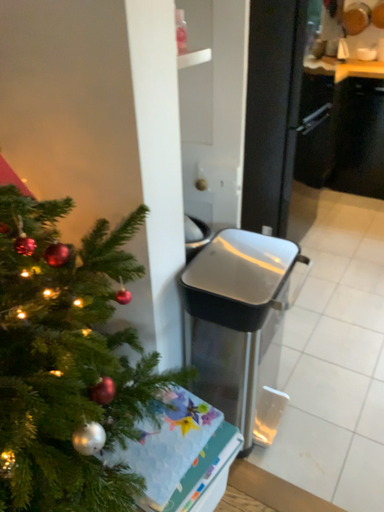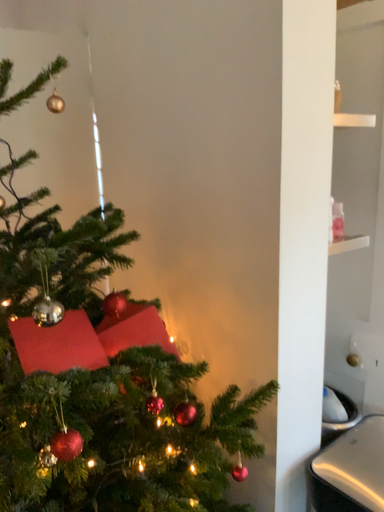
Question: How did the camera likely rotate when shooting the video?

Choices:
 (A) rotated downward
 (B) rotated upward

Answer: (B)